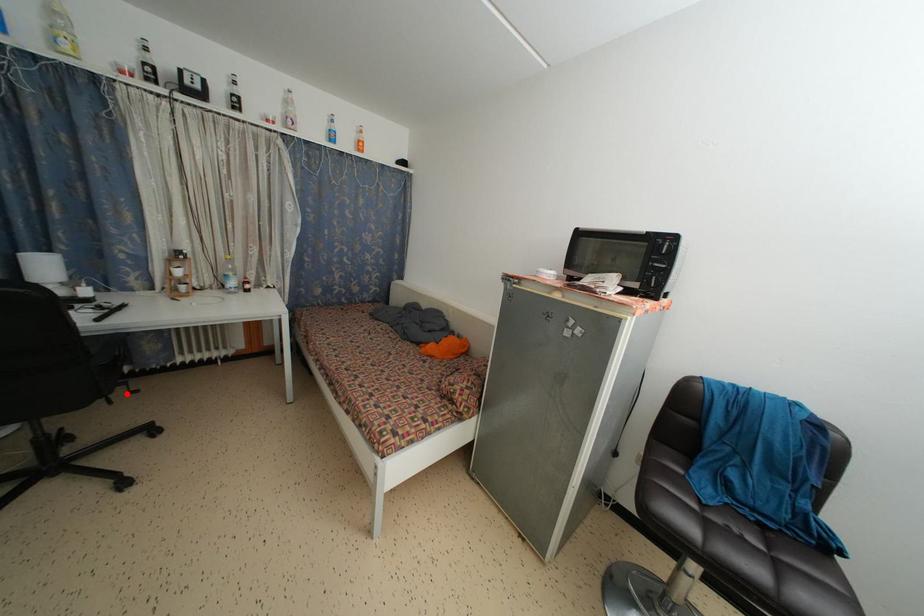
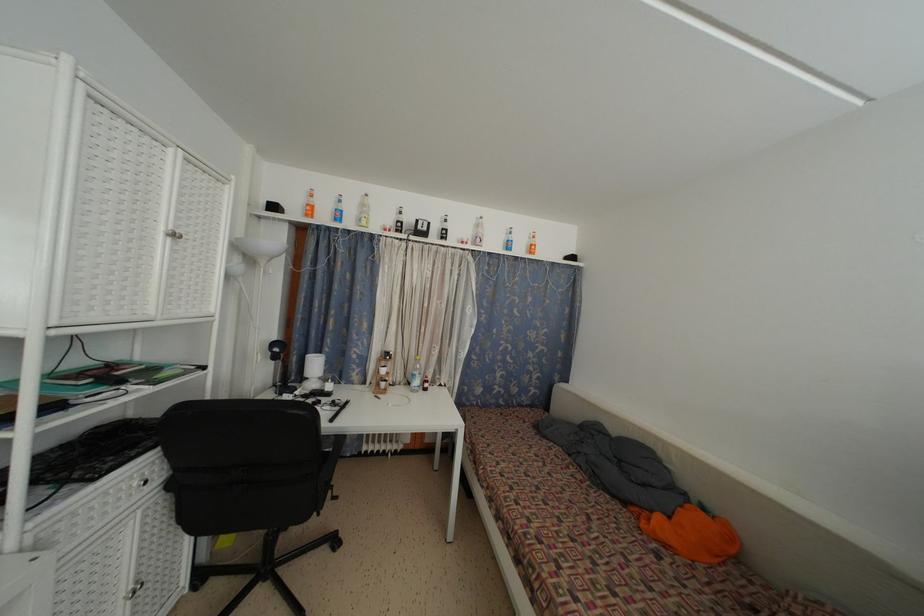
Find the pixel in the second image that matches the highlighted location in the first image.

(333, 498)